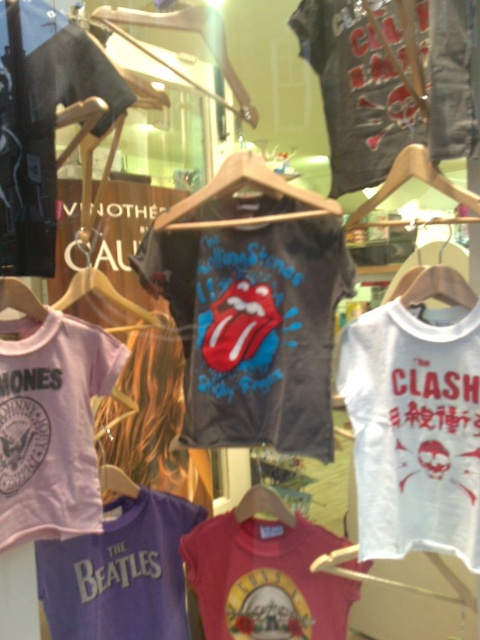
Does white cotton t-shirt at right appear over purple cotton t-shirt at center?

Yes.

Which is behind, point (440, 435) or point (90, 625)?

Positioned behind is point (90, 625).

Which is in front, point (432, 428) or point (123, 637)?

Positioned in front is point (432, 428).

I want to click on white cotton t-shirt at right, so click(x=414, y=432).

What do you see at coordinates (265, 579) in the screenshot?
I see `matte pink t-shirt at center` at bounding box center [265, 579].

The image size is (480, 640). I want to click on matte pink t-shirt at center, so [265, 579].

Can you confirm if dark gray t-shirt with glossy print at center is positioned above wooden hanger at center?

Indeed, dark gray t-shirt with glossy print at center is positioned over wooden hanger at center.

This screenshot has height=640, width=480. What do you see at coordinates (263, 336) in the screenshot?
I see `dark gray t-shirt with glossy print at center` at bounding box center [263, 336].

Does point (220, 330) come closer to viewer compared to point (268, 500)?

That is True.

At what (x,y) coordinates should I click in order to perform the action: click on dark gray t-shirt with glossy print at center. Please return your answer as a coordinate pair (x, y). The image size is (480, 640). Looking at the image, I should click on (263, 336).